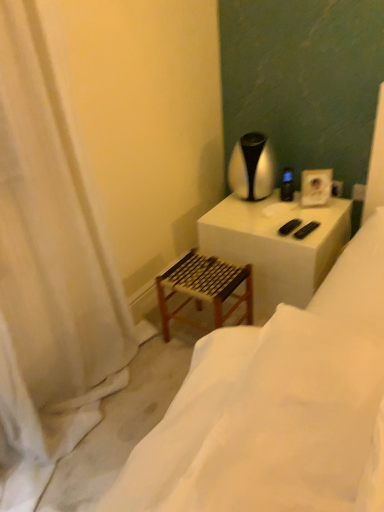
Question: Does silver metallic table lamp at upper right have a greater width compared to wooden stool at lower left?

Choices:
 (A) no
 (B) yes

Answer: (A)

Question: Can you confirm if silver metallic table lamp at upper right is thinner than wooden stool at lower left?

Choices:
 (A) yes
 (B) no

Answer: (A)

Question: Are silver metallic table lamp at upper right and wooden stool at lower left beside each other?

Choices:
 (A) yes
 (B) no

Answer: (B)

Question: Can you confirm if silver metallic table lamp at upper right is smaller than wooden stool at lower left?

Choices:
 (A) yes
 (B) no

Answer: (A)

Question: Considering the relative sizes of silver metallic table lamp at upper right and wooden stool at lower left in the image provided, is silver metallic table lamp at upper right taller than wooden stool at lower left?

Choices:
 (A) no
 (B) yes

Answer: (B)

Question: Considering the positions of white fabric curtain at left and wooden stool at lower left in the image, is white fabric curtain at left bigger or smaller than wooden stool at lower left?

Choices:
 (A) small
 (B) big

Answer: (B)

Question: In the image, is white fabric curtain at left positioned in front of or behind wooden stool at lower left?

Choices:
 (A) front
 (B) behind

Answer: (B)

Question: Is point (39, 249) closer or farther from the camera than point (342, 492)?

Choices:
 (A) closer
 (B) farther

Answer: (B)

Question: Considering the positions of white fabric curtain at left and wooden stool at lower left in the image, is white fabric curtain at left taller or shorter than wooden stool at lower left?

Choices:
 (A) short
 (B) tall

Answer: (B)

Question: From a real-world perspective, relative to black plastic remote control at upper right, is silver metallic table lamp at upper right vertically above or below?

Choices:
 (A) above
 (B) below

Answer: (A)

Question: Considering their positions, is silver metallic table lamp at upper right located in front of or behind black plastic remote control at upper right?

Choices:
 (A) behind
 (B) front

Answer: (B)

Question: Do you think silver metallic table lamp at upper right is within black plastic remote control at upper right, or outside of it?

Choices:
 (A) inside
 (B) outside

Answer: (B)

Question: Looking at the image, does silver metallic table lamp at upper right seem bigger or smaller compared to black plastic remote control at upper right?

Choices:
 (A) small
 (B) big

Answer: (B)

Question: From a real-world perspective, is wooden stool at lower left positioned above or below wooden woven step stool at lower left?

Choices:
 (A) above
 (B) below

Answer: (A)

Question: Is wooden stool at lower left taller or shorter than wooden woven step stool at lower left?

Choices:
 (A) tall
 (B) short

Answer: (B)